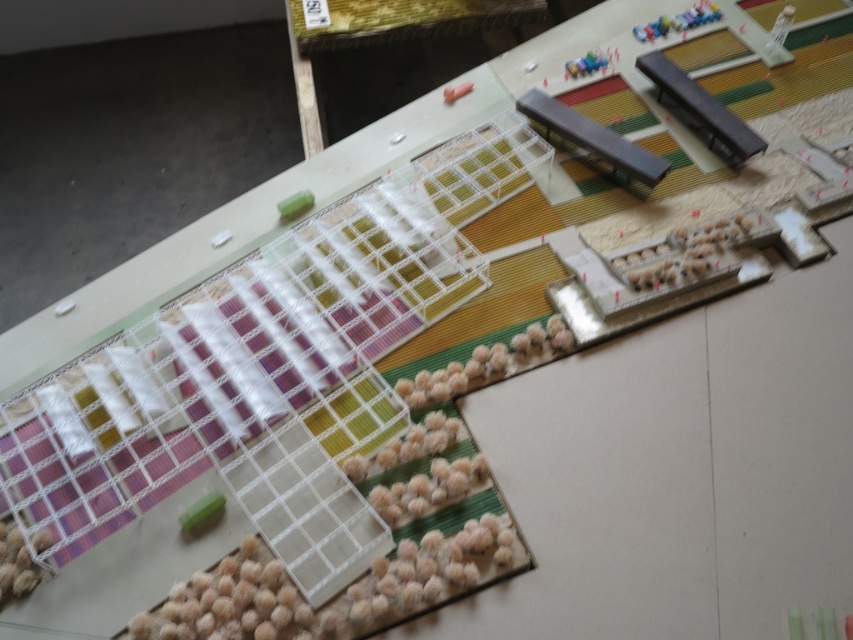
Question: Estimate the real-world distances between objects in this image. Which object is farther from the pink rubber toy at upper center?

Choices:
 (A) green matte cube at center-left
 (B) green plastic toy at lower left

Answer: (B)

Question: Does green matte cube at center-left have a larger size compared to pink rubber toy at upper center?

Choices:
 (A) no
 (B) yes

Answer: (B)

Question: Does green plastic toy at lower left have a lesser width compared to green matte cube at center-left?

Choices:
 (A) yes
 (B) no

Answer: (A)

Question: Is the position of green plastic toy at lower left more distant than that of green matte cube at center-left?

Choices:
 (A) no
 (B) yes

Answer: (A)

Question: Which point is farther to the camera?

Choices:
 (A) green matte cube at center-left
 (B) green plastic toy at lower left
 (C) pink rubber toy at upper center

Answer: (C)

Question: Among these points, which one is nearest to the camera?

Choices:
 (A) (180, 513)
 (B) (294, 214)

Answer: (A)